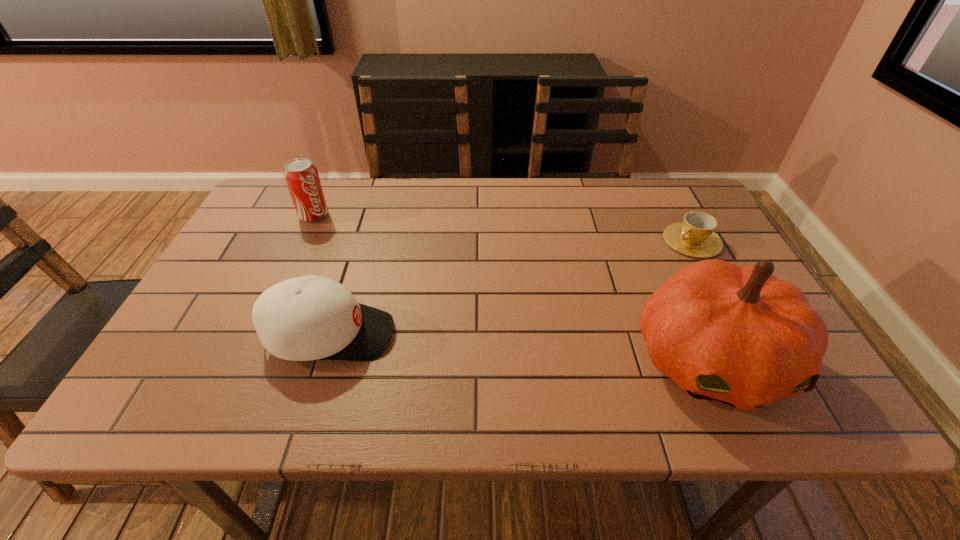
Where is `free space between the baseball cap and the pumpkin`? The width and height of the screenshot is (960, 540). free space between the baseball cap and the pumpkin is located at coordinates (520, 347).

Image resolution: width=960 pixels, height=540 pixels. I want to click on empty space that is in between the shortest object and the soda can, so click(503, 228).

Image resolution: width=960 pixels, height=540 pixels. Identify the location of free space between the soda can and the third tallest object. (322, 275).

In order to click on vacant area between the third tallest object and the tallest object in this screenshot , I will do `click(520, 347)`.

This screenshot has width=960, height=540. Find the location of `object that stands as the closest to the pumpkin`. object that stands as the closest to the pumpkin is located at coordinates (695, 236).

Point out which object is positioned as the nearest to the soda can. Please provide its 2D coordinates. Your answer should be formatted as a tuple, i.e. [(x, y)], where the tuple contains the x and y coordinates of a point satisfying the conditions above.

[(306, 318)]

This screenshot has height=540, width=960. Find the location of `vacant area in the image that satisfies the following two spatial constraints: 1. on the front side of the soda can; 2. on the right side of the shortest object`. vacant area in the image that satisfies the following two spatial constraints: 1. on the front side of the soda can; 2. on the right side of the shortest object is located at coordinates (302, 241).

In order to click on vacant point that satisfies the following two spatial constraints: 1. on the front side of the soda can; 2. on the left side of the cup in this screenshot , I will do `click(302, 241)`.

The width and height of the screenshot is (960, 540). I want to click on vacant space that satisfies the following two spatial constraints: 1. on the front side of the soda can; 2. on the front-facing side of the baseball cap, so click(x=259, y=335).